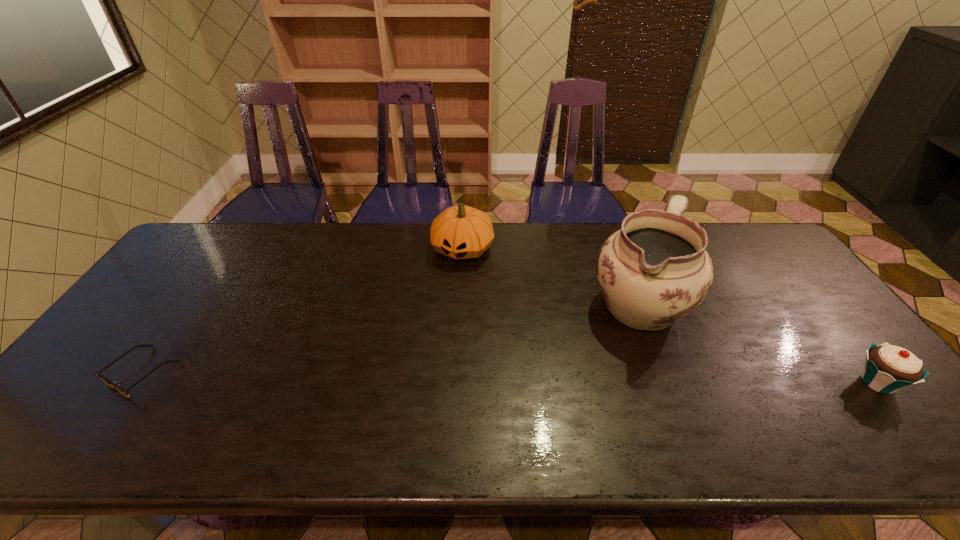
Identify the location of vacant space on the desktop that is between the sunglasses and the second shortest object and is positioned on the side of the third object from right to left with the carved face. Image resolution: width=960 pixels, height=540 pixels. (411, 376).

The width and height of the screenshot is (960, 540). I want to click on vacant space on the desktop that is between the sunglasses and the rightmost object and is positioned on the spout of the second object from right to left, so click(582, 379).